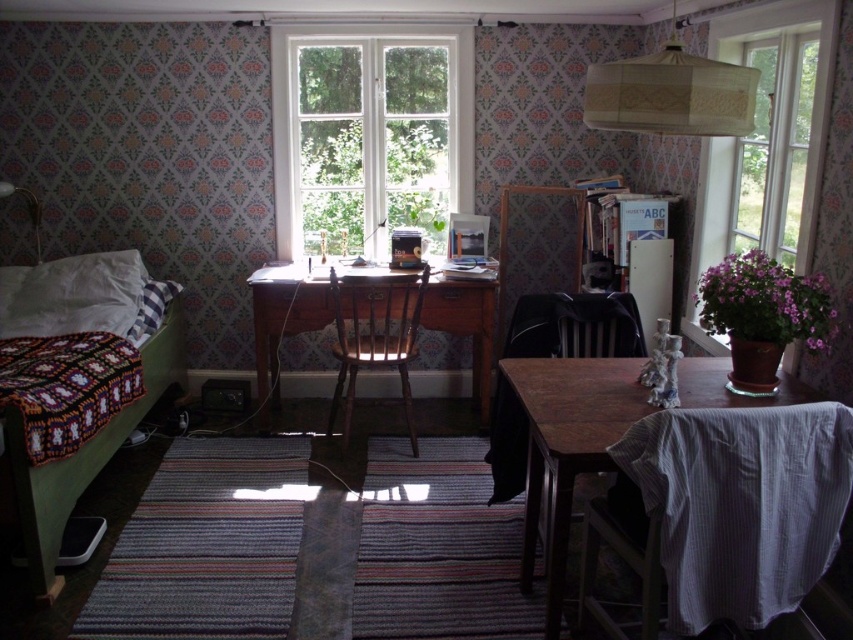
In the scene shown: Who is shorter, wooden table at lower right or dark wood chair at lower center?

wooden table at lower right

Is wooden table at lower right above dark wood chair at lower center?

No, wooden table at lower right is not above dark wood chair at lower center.

Between point (579, 422) and point (554, 348), which one is positioned in front?

Point (579, 422) is in front.

Where is `wooden table at lower right`? The image size is (853, 640). wooden table at lower right is located at coordinates (567, 445).

From the picture: How much distance is there between beige fabric lampshade at upper center and knitted fabric bed at left?

beige fabric lampshade at upper center and knitted fabric bed at left are 7.62 feet apart.

Is beige fabric lampshade at upper center positioned in front of knitted fabric bed at left?

Yes, it is.

At what (x,y) coordinates should I click in order to perform the action: click on beige fabric lampshade at upper center. Please return your answer as a coordinate pair (x, y). This screenshot has width=853, height=640. Looking at the image, I should click on (670, 93).

Looking at this image, does clear glass window at center have a smaller size compared to dark wood chair at lower center?

No.

Describe the element at coordinates (369, 134) in the screenshot. I see `clear glass window at center` at that location.

Which is behind, point (401, 221) or point (531, 321)?

Point (401, 221)

You are a GUI agent. You are given a task and a screenshot of the screen. Output one action in this format:
    pyautogui.click(x=<x>, y=<y>)
    Task: Click on the clear glass window at center
    Image resolution: width=853 pixels, height=640 pixels.
    Given the screenshot: What is the action you would take?
    pyautogui.click(x=369, y=134)